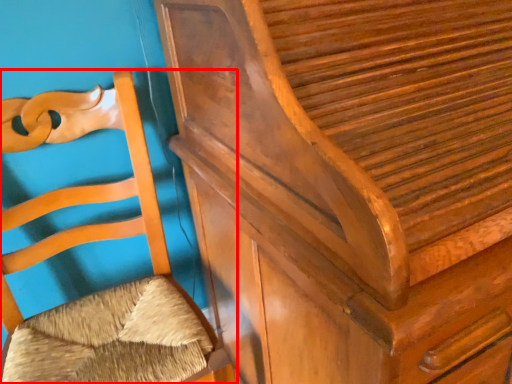
Question: Considering the relative positions of furniture (annotated by the red box) and furniture in the image provided, where is furniture (annotated by the red box) located with respect to the staircase?

Choices:
 (A) right
 (B) left

Answer: (B)